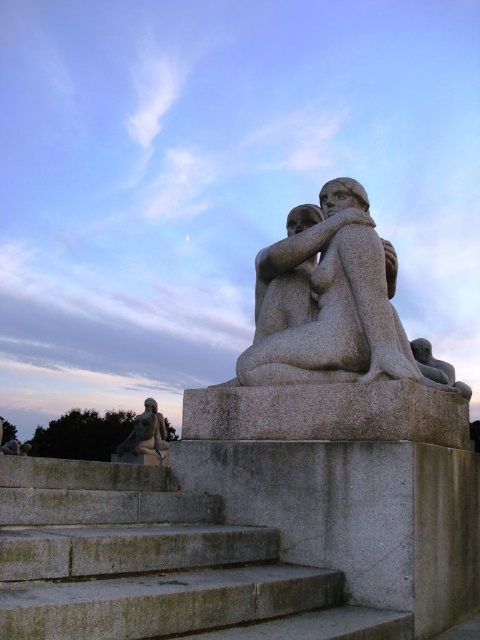
Which is more to the left, granite statue at center or smooth gray stone figure at lower left?

smooth gray stone figure at lower left is more to the left.

Is granite statue at center behind smooth gray stone figure at lower left?

No.

Does point (322, 269) come closer to viewer compared to point (135, 436)?

Yes, point (322, 269) is closer to viewer.

Identify the location of granite statue at center. Image resolution: width=480 pixels, height=640 pixels. (335, 305).

Who is taller, gray concrete stairs at lower center or smooth gray stone figure at lower left?

smooth gray stone figure at lower left is taller.

Is gray concrete stairs at lower center below smooth gray stone figure at lower left?

Actually, gray concrete stairs at lower center is above smooth gray stone figure at lower left.

Is point (181, 552) less distant than point (152, 426)?

That is True.

At what (x,y) coordinates should I click in order to perform the action: click on gray concrete stairs at lower center. Please return your answer as a coordinate pair (x, y). The height and width of the screenshot is (640, 480). Looking at the image, I should click on (154, 564).

Who is more forward, (132, 602) or (359, 248)?

Point (132, 602)

Does gray concrete stairs at lower center come behind granite statue at center?

No, gray concrete stairs at lower center is in front of granite statue at center.

Measure the distance between point (168, 582) and camera.

Point (168, 582) and camera are 78.92 feet apart from each other.

At what (x,y) coordinates should I click in order to perform the action: click on gray concrete stairs at lower center. Please return your answer as a coordinate pair (x, y). This screenshot has width=480, height=640. Looking at the image, I should click on (154, 564).